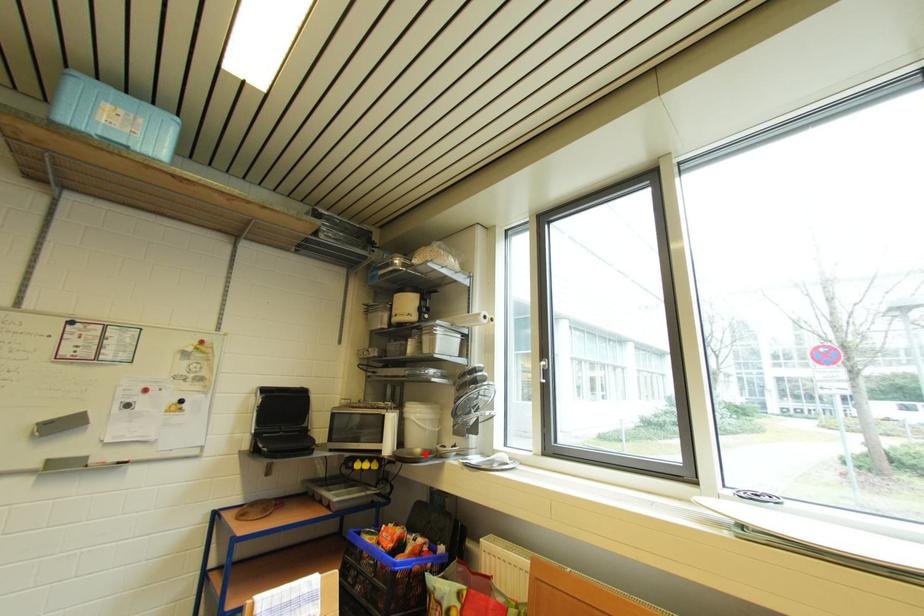
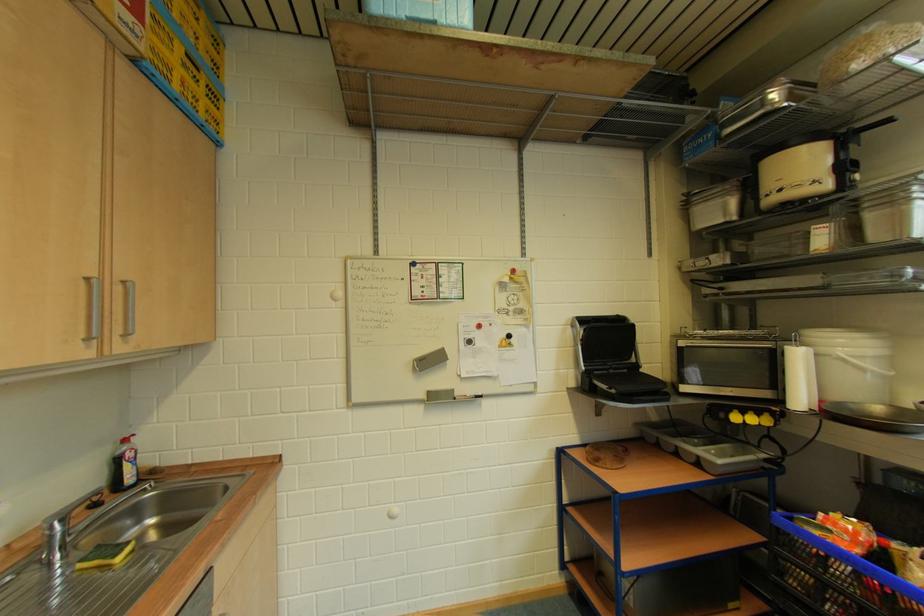
Where in the second image is the point corresponding to the highlighted location from the first image?

(884, 411)